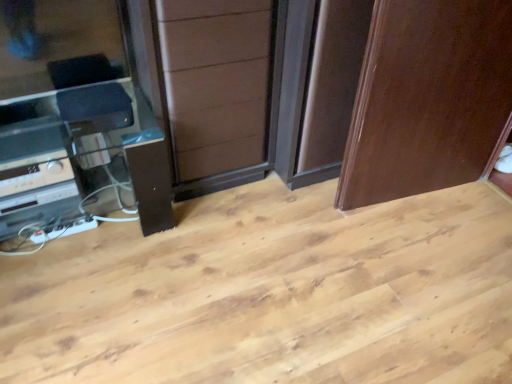
This screenshot has height=384, width=512. What are the coordinates of `vacant area situated to the left side of glossy wood door at upper right` in the screenshot? It's located at (306, 227).